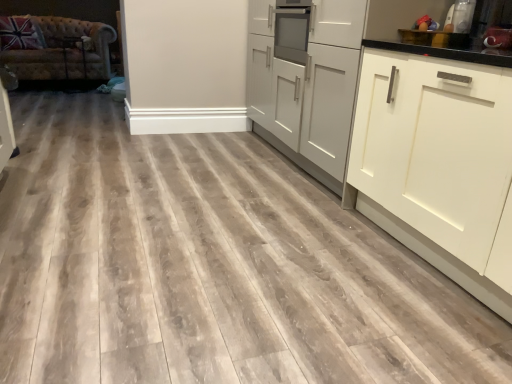
Question: Would you say metallic silver toaster at upper right, the second appliance in the right-to-left sequence, contains tufted leather couch at left?

Choices:
 (A) yes
 (B) no

Answer: (B)

Question: Does metallic silver toaster at upper right, the second appliance in the right-to-left sequence, have a greater width compared to tufted leather couch at left?

Choices:
 (A) yes
 (B) no

Answer: (B)

Question: From a real-world perspective, is metallic silver toaster at upper right, the second appliance in the right-to-left sequence, under tufted leather couch at left?

Choices:
 (A) yes
 (B) no

Answer: (B)

Question: Is metallic silver toaster at upper right, which is counted as the 1th appliance, starting from the left, far away from tufted leather couch at left?

Choices:
 (A) yes
 (B) no

Answer: (A)

Question: Considering the relative sizes of metallic silver toaster at upper right, the second appliance in the right-to-left sequence, and tufted leather couch at left in the image provided, is metallic silver toaster at upper right, the second appliance in the right-to-left sequence, smaller than tufted leather couch at left?

Choices:
 (A) no
 (B) yes

Answer: (B)

Question: Considering their positions, is white matte cabinet at right, positioned as the 1th cabinetry in right-to-left order, located in front of or behind matte gray cabinets at center, the first cabinetry in the left-to-right sequence?

Choices:
 (A) behind
 (B) front

Answer: (A)

Question: Is white matte cabinet at right, positioned as the 1th cabinetry in right-to-left order, bigger or smaller than matte gray cabinets at center, the first cabinetry in the left-to-right sequence?

Choices:
 (A) small
 (B) big

Answer: (A)

Question: Is white matte cabinet at right, positioned as the 1th cabinetry in right-to-left order, situated inside matte gray cabinets at center, the first cabinetry in the left-to-right sequence, or outside?

Choices:
 (A) outside
 (B) inside

Answer: (B)

Question: Would you say white matte cabinet at right, positioned as the 1th cabinetry in right-to-left order, is to the left or to the right of matte gray cabinets at center, the 2th cabinetry from the right, in the picture?

Choices:
 (A) left
 (B) right

Answer: (B)

Question: Is metallic silver toaster at upper right, which appears as the first appliance when viewed from the right, taller or shorter than metallic silver toaster at upper right, which is counted as the 1th appliance, starting from the left?

Choices:
 (A) tall
 (B) short

Answer: (B)

Question: From a real-world perspective, is metallic silver toaster at upper right, which appears as the first appliance when viewed from the right, above or below metallic silver toaster at upper right, the second appliance in the right-to-left sequence?

Choices:
 (A) below
 (B) above

Answer: (A)

Question: Does point (509, 31) appear closer or farther from the camera than point (458, 1)?

Choices:
 (A) farther
 (B) closer

Answer: (B)

Question: Considering their positions, is metallic silver toaster at upper right, which appears as the first appliance when viewed from the right, located in front of or behind metallic silver toaster at upper right, which is counted as the 1th appliance, starting from the left?

Choices:
 (A) behind
 (B) front

Answer: (B)

Question: Considering their positions, is white matte cabinet at right, arranged as the 2th cabinetry when viewed from the left, located in front of or behind metallic silver toaster at upper right, the second appliance in the right-to-left sequence?

Choices:
 (A) behind
 (B) front

Answer: (B)

Question: Is white matte cabinet at right, positioned as the 1th cabinetry in right-to-left order, wider or thinner than metallic silver toaster at upper right, which is counted as the 1th appliance, starting from the left?

Choices:
 (A) wide
 (B) thin

Answer: (A)